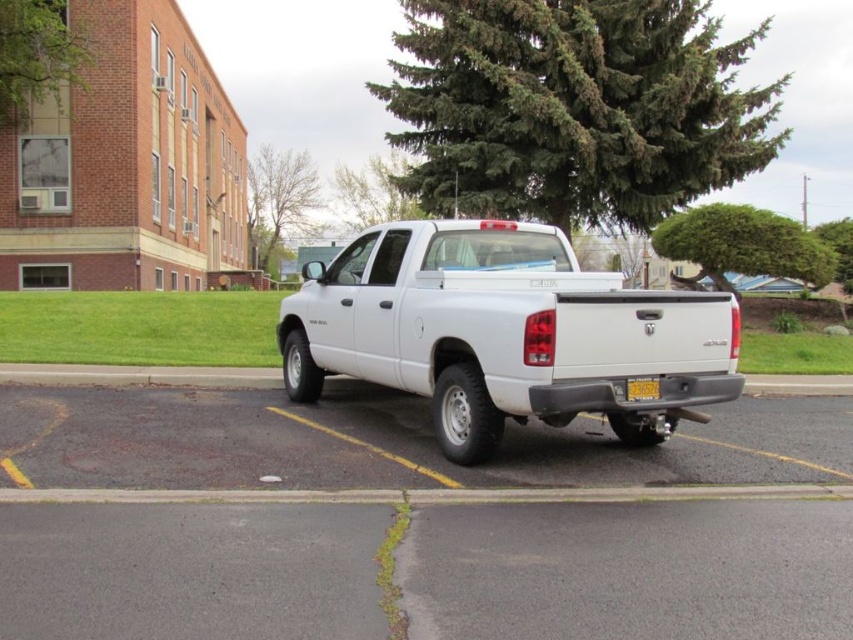
Question: Which of the following is the closest to the observer?

Choices:
 (A) (642, 394)
 (B) (311, 189)
 (C) (123, 477)

Answer: (C)

Question: Among these objects, which one is nearest to the camera?

Choices:
 (A) green textured tree at upper center
 (B) yellow matte license plate at rear

Answer: (B)

Question: Does green textured tree at upper center appear over green leafy tree at upper right?

Choices:
 (A) no
 (B) yes

Answer: (B)

Question: Does white rubber parking lot at center appear under green leafy tree at upper left?

Choices:
 (A) yes
 (B) no

Answer: (A)

Question: Among these objects, which one is farthest from the camera?

Choices:
 (A) green needle-like leaves at upper center
 (B) green leafy tree at upper right
 (C) white rubber parking lot at center

Answer: (B)

Question: Can you confirm if green leafy tree at upper center is positioned to the right of green textured tree at upper center?

Choices:
 (A) yes
 (B) no

Answer: (B)